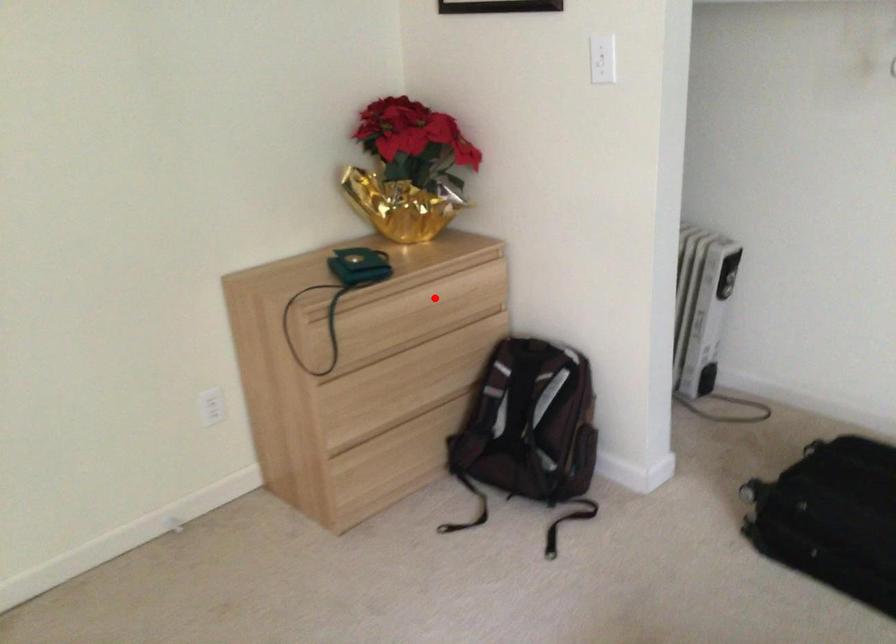
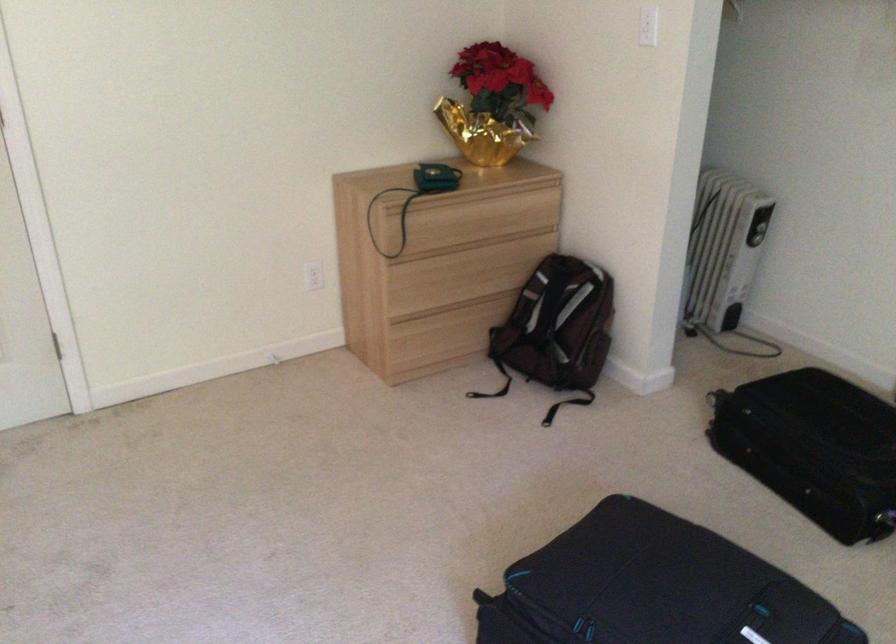
Locate, in the second image, the point that corresponds to the highlighted location in the first image.

(492, 210)